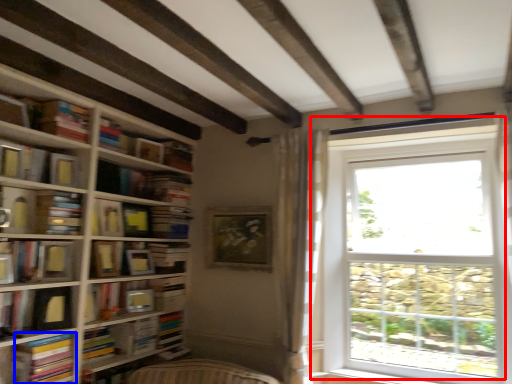
Question: Among these objects, which one is farthest to the camera, window (highlighted by a red box) or paperback book (highlighted by a blue box)?

Choices:
 (A) window
 (B) paperback book

Answer: (A)